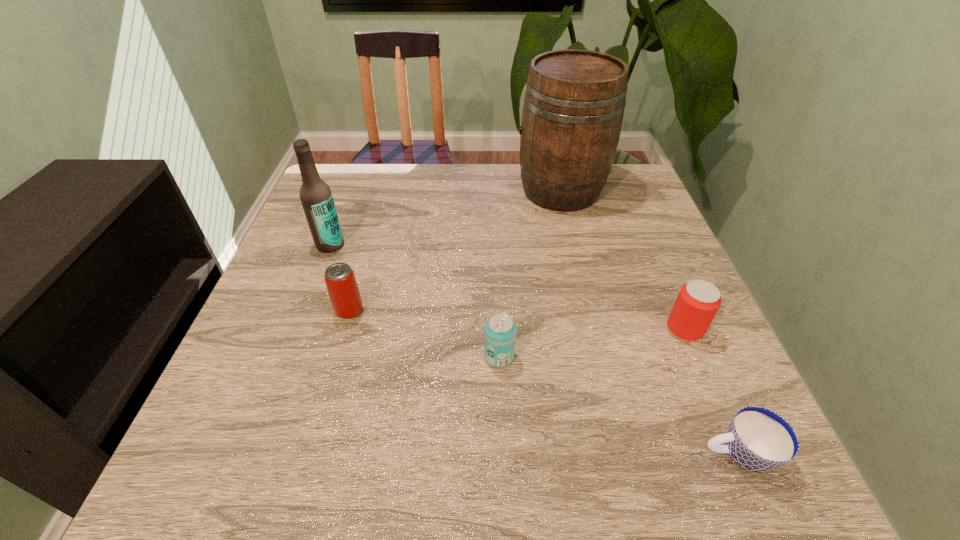
This screenshot has height=540, width=960. What are the coordinates of `free space at the left edge of the desktop` in the screenshot? It's located at pyautogui.click(x=292, y=276).

Locate an element on the screen. Image resolution: width=960 pixels, height=540 pixels. free space at the right edge is located at coordinates (625, 302).

Locate an element on the screen. The image size is (960, 540). vacant region at the far left corner of the desktop is located at coordinates (377, 174).

I want to click on vacant space that is in between the cider and the rightmost beer can, so click(x=622, y=260).

The height and width of the screenshot is (540, 960). I want to click on empty location between the shortest object and the rightmost beer can, so click(x=711, y=392).

Find the location of a particular element. This screenshot has width=960, height=540. vacant point located between the leftmost beer can and the nearest object is located at coordinates (543, 382).

This screenshot has width=960, height=540. I want to click on free spot between the leftmost beer can and the farthest object, so click(x=455, y=251).

What are the coordinates of `vacant space that is in between the cider and the leftmost object` in the screenshot? It's located at (445, 218).

Where is `vacant area between the fifth nearest object and the second beer can from left to right`? The width and height of the screenshot is (960, 540). vacant area between the fifth nearest object and the second beer can from left to right is located at coordinates (415, 301).

At what (x,y) coordinates should I click in order to perform the action: click on empty space between the fifth shortest object and the cup. Please return your answer as a coordinate pair (x, y). Looking at the image, I should click on (534, 349).